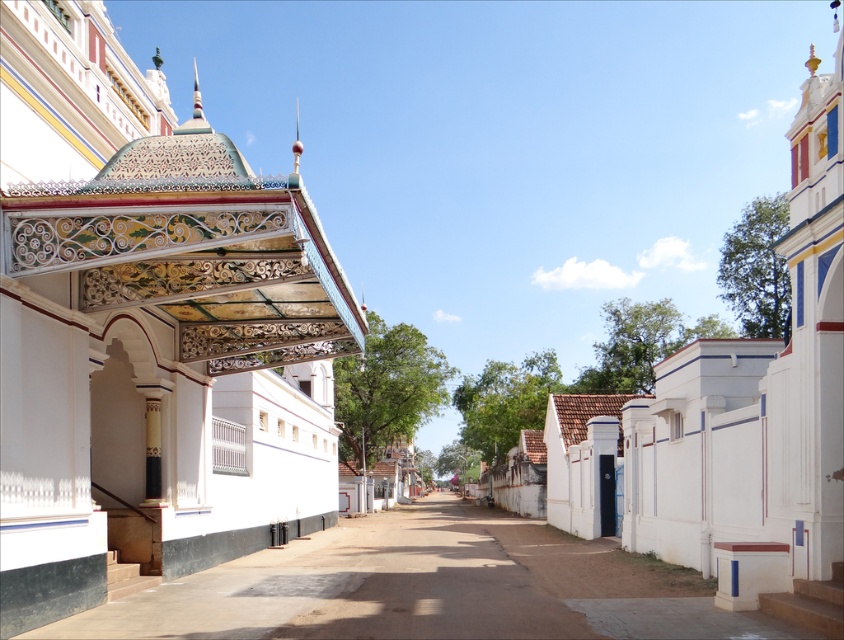
Question: Is decorative painted ceiling at upper left bigger than smooth concrete alley at center?

Choices:
 (A) yes
 (B) no

Answer: (A)

Question: Which of the following is the farthest from the observer?

Choices:
 (A) (171, 372)
 (B) (626, 428)

Answer: (B)

Question: Among these objects, which one is farthest from the camera?

Choices:
 (A) smooth concrete alley at center
 (B) decorative painted ceiling at upper left

Answer: (B)

Question: Which object appears closest to the camera in this image?

Choices:
 (A) decorative painted ceiling at upper left
 (B) white painted wall at center

Answer: (B)

Question: Considering the relative positions of decorative painted ceiling at upper left and white painted wall at center in the image provided, where is decorative painted ceiling at upper left located with respect to white painted wall at center?

Choices:
 (A) right
 (B) left

Answer: (B)

Question: Does decorative painted ceiling at upper left appear under smooth concrete alley at center?

Choices:
 (A) no
 (B) yes

Answer: (A)